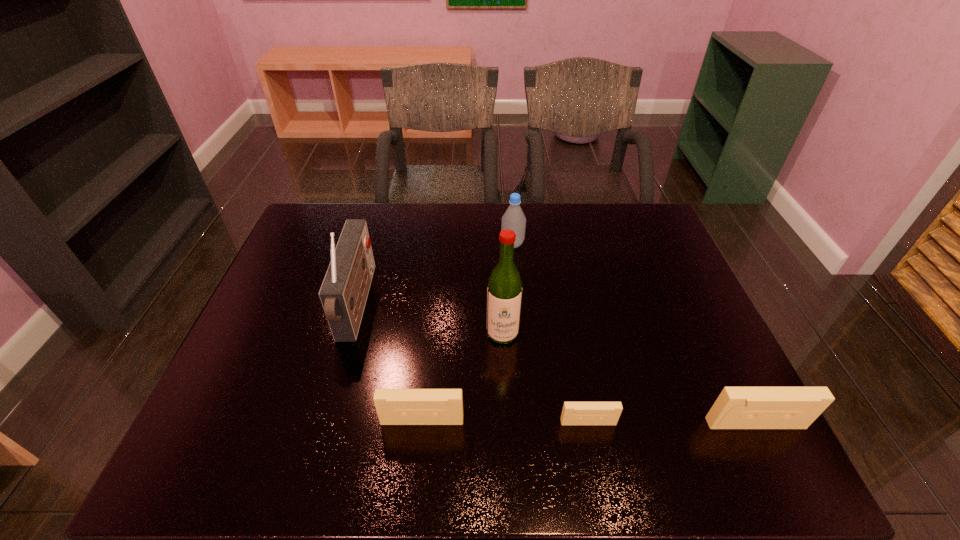
The image size is (960, 540). I want to click on the leftmost videotape, so click(394, 406).

Image resolution: width=960 pixels, height=540 pixels. I want to click on the fifth tallest object, so click(394, 406).

Find the location of a particular element. This screenshot has width=960, height=540. the shortest videotape is located at coordinates (573, 413).

Locate an element on the screen. The image size is (960, 540). the second object from right to left is located at coordinates (573, 413).

Identify the location of the rightmost object. This screenshot has height=540, width=960. (736, 407).

Locate an element on the screen. the farthest object is located at coordinates (514, 219).

Where is `bottle`? The image size is (960, 540). bottle is located at coordinates (514, 219).

Identify the location of the fifth shortest object. (344, 291).

Where is `the leftmost object`? Image resolution: width=960 pixels, height=540 pixels. the leftmost object is located at coordinates (344, 291).

You are a GUI agent. You are given a task and a screenshot of the screen. Output one action in this format:
    pyautogui.click(x=<x>, y=<y>)
    Task: Click on the liquor
    The image size is (960, 540).
    Given the screenshot: What is the action you would take?
    pyautogui.click(x=504, y=292)